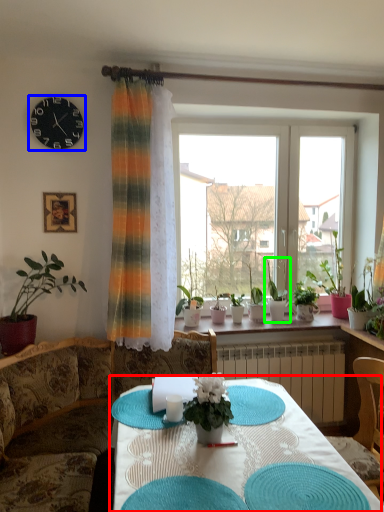
Question: Which object is positioned closest to table (highlighted by a red box)? Select from clock (highlighted by a blue box) and houseplant (highlighted by a green box).

Choices:
 (A) clock
 (B) houseplant

Answer: (B)